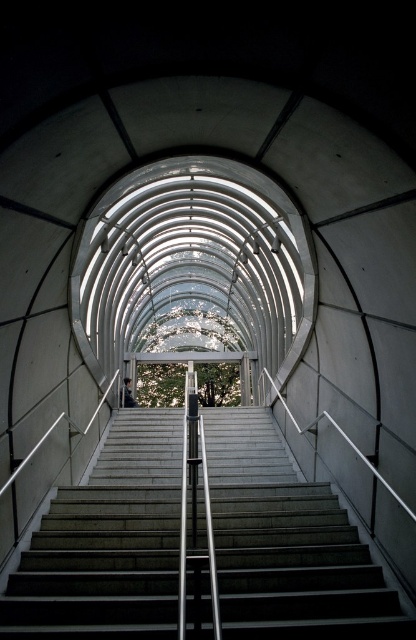
Question: Which object appears farthest from the camera in this image?

Choices:
 (A) concrete stairs at center
 (B) dark gray fabric jacket at center

Answer: (B)

Question: Is concrete stairs at center positioned in front of dark gray fabric jacket at center?

Choices:
 (A) no
 (B) yes

Answer: (B)

Question: Does concrete stairs at center have a lesser width compared to dark gray fabric jacket at center?

Choices:
 (A) no
 (B) yes

Answer: (A)

Question: Can you confirm if concrete stairs at center is wider than dark gray fabric jacket at center?

Choices:
 (A) no
 (B) yes

Answer: (B)

Question: Among these objects, which one is nearest to the camera?

Choices:
 (A) concrete stairs at center
 (B) dark gray fabric jacket at center

Answer: (A)